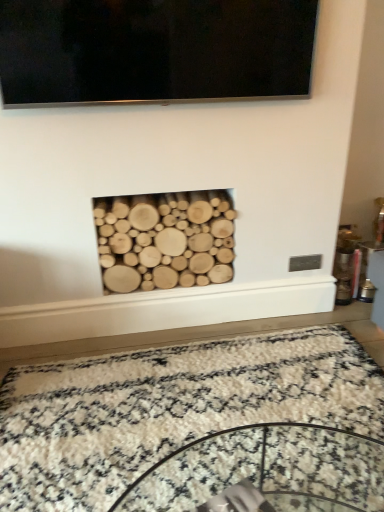
Find the location of `free point below black glossy flat-screen tv at upper center (from a real-world perspective)`. free point below black glossy flat-screen tv at upper center (from a real-world perspective) is located at coordinates (184, 330).